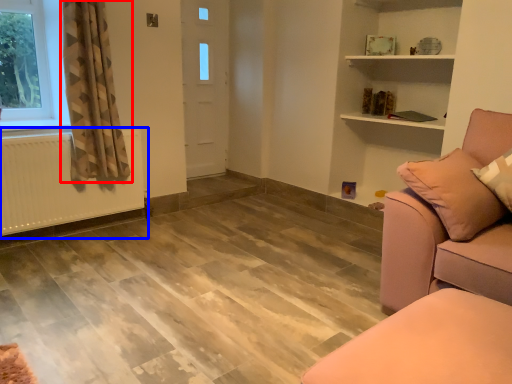
Question: Which of the following is the farthest to the observer, curtain (highlighted by a red box) or radiator (highlighted by a blue box)?

Choices:
 (A) curtain
 (B) radiator

Answer: (B)